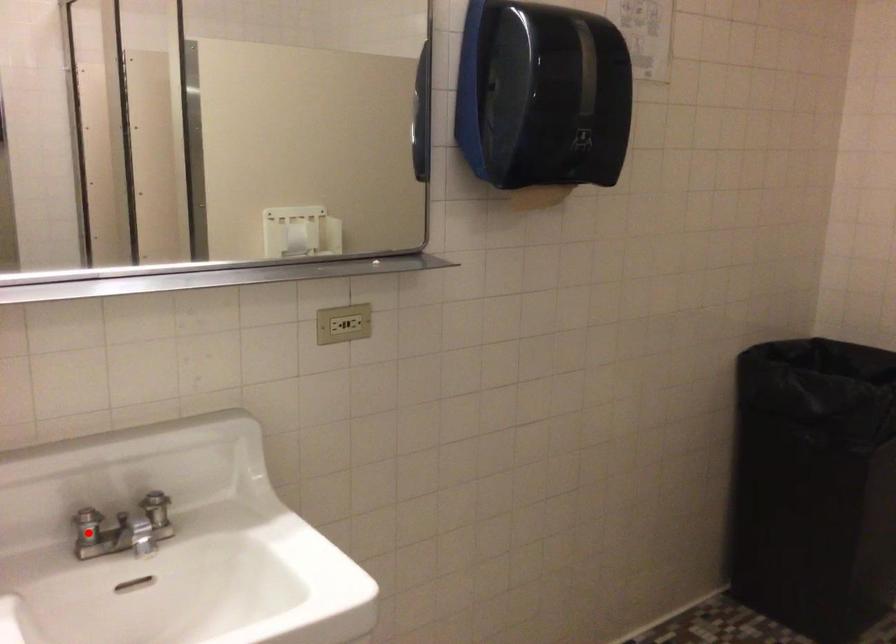
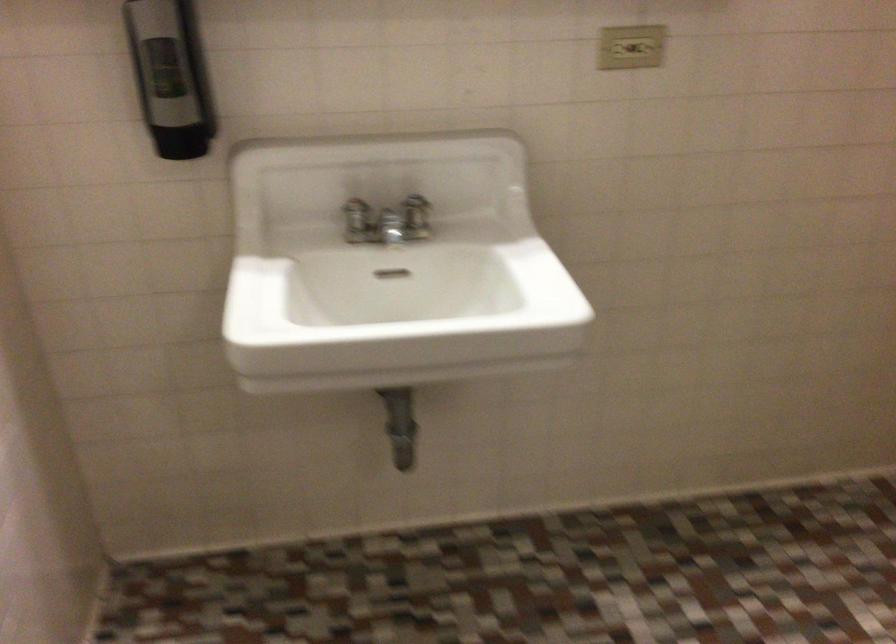
Question: I am providing you with two images of the same scene from different viewpoints. Image1 has a red point marked. In image2, the corresponding 3D location appears at what relative position? Reply with the corresponding letter.

Choices:
 (A) Closer
 (B) Farther

Answer: (B)